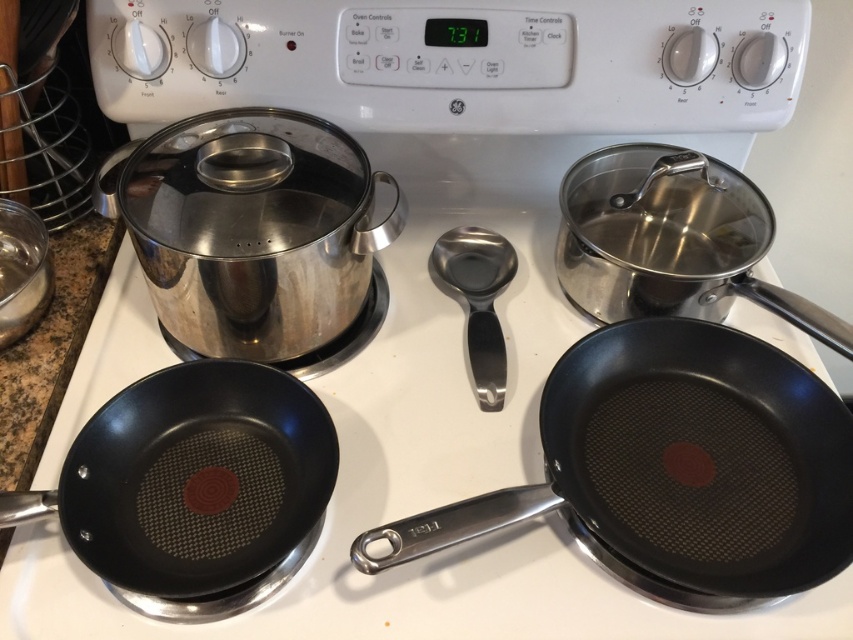
Question: Which point is farther from the camera taking this photo?

Choices:
 (A) (189, 550)
 (B) (473, 308)
 (C) (602, 380)

Answer: (B)

Question: Is non-stick black frying pan at center positioned before non-stick black frying pan at lower left?

Choices:
 (A) no
 (B) yes

Answer: (A)

Question: Which point is closer to the camera?

Choices:
 (A) coord(76,477)
 (B) coord(492,376)

Answer: (A)

Question: Where is non-stick black frying pan at center located in relation to stainless steel measuring spoon at center in the image?

Choices:
 (A) right
 (B) left

Answer: (A)

Question: Among these points, which one is nearest to the camera?

Choices:
 (A) (108, 572)
 (B) (502, 356)

Answer: (A)

Question: Does non-stick black frying pan at center have a smaller size compared to stainless steel measuring spoon at center?

Choices:
 (A) yes
 (B) no

Answer: (B)